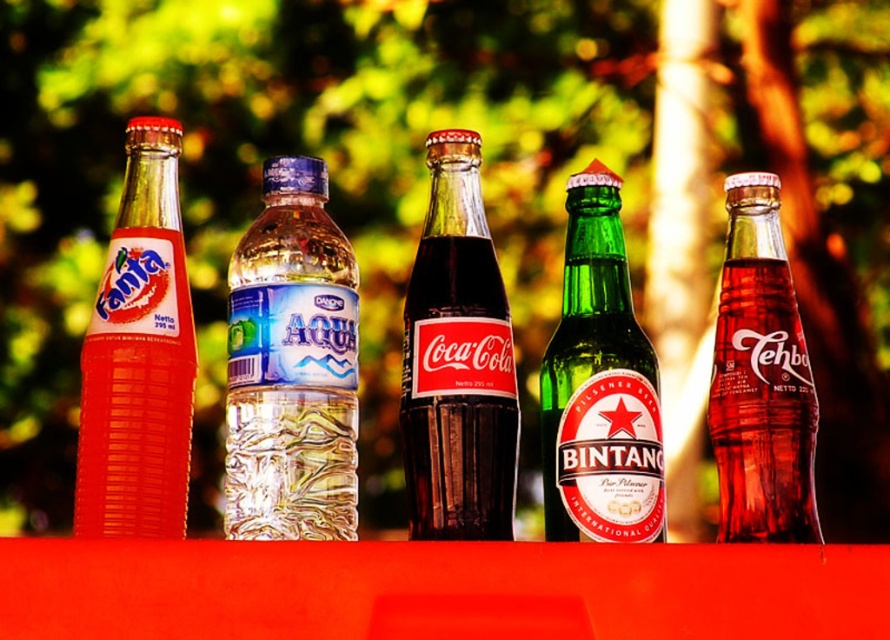
Which is in front, point (255, 515) or point (487, 342)?

Point (255, 515) is more forward.

Between point (344, 529) and point (464, 468), which one is positioned behind?

The point (344, 529) is behind.

Find the location of a particular element. This screenshot has height=640, width=890. clear plastic bottle at center is located at coordinates (290, 365).

In the scene shown: Which is more to the left, clear plastic bottle at center or translucent glass fanta bottle at left?

Positioned to the left is translucent glass fanta bottle at left.

Is clear plastic bottle at center taller than translucent glass fanta bottle at left?

In fact, clear plastic bottle at center may be shorter than translucent glass fanta bottle at left.

Between point (255, 237) and point (158, 397), which one is positioned in front?

Point (158, 397) is more forward.

Identify the location of clear plastic bottle at center. (290, 365).

Does translucent glass fanta bottle at left have a greater width compared to translucent glass bottle at center?

Incorrect, translucent glass fanta bottle at left's width does not surpass translucent glass bottle at center's.

Which is below, translucent glass fanta bottle at left or translucent glass bottle at center?

Positioned lower is translucent glass bottle at center.

Does point (134, 214) come behind point (729, 324)?

No, it is in front of (729, 324).

This screenshot has height=640, width=890. What are the coordinates of `translucent glass fanta bottle at left` in the screenshot? It's located at (139, 356).